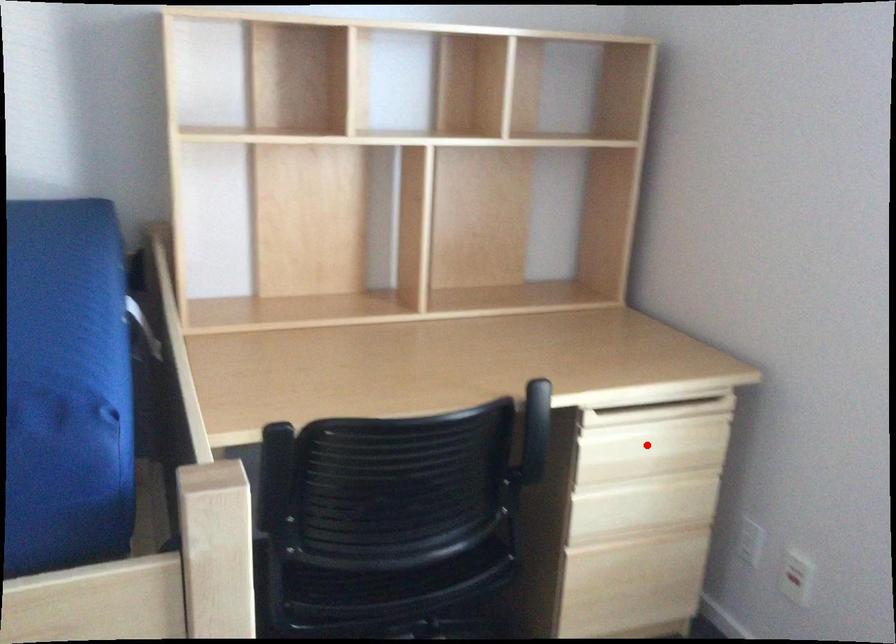
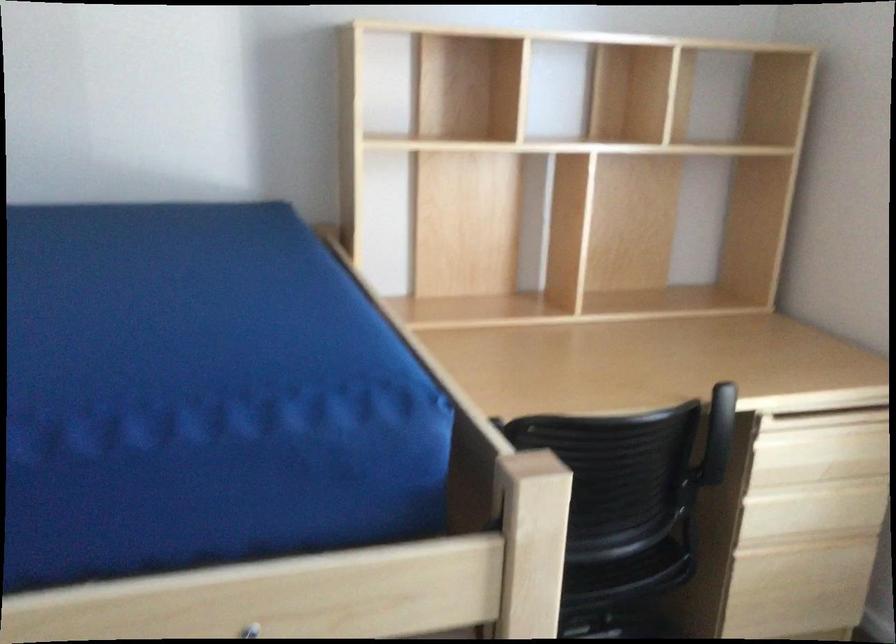
Question: I am providing you with two images of the same scene from different viewpoints. A red point is marked on the first image. Is the red point's position out of view in image 2?

Choices:
 (A) Yes
 (B) No

Answer: (B)